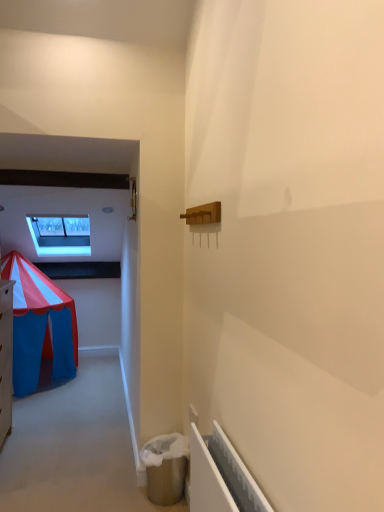
Question: Does white plastic radiator at lower right appear on the right side of transparent glass window at upper left?

Choices:
 (A) yes
 (B) no

Answer: (A)

Question: Does white plastic radiator at lower right have a larger size compared to transparent glass window at upper left?

Choices:
 (A) yes
 (B) no

Answer: (B)

Question: Is white plastic radiator at lower right turned away from transparent glass window at upper left?

Choices:
 (A) yes
 (B) no

Answer: (B)

Question: Would you say transparent glass window at upper left is part of white plastic radiator at lower right's contents?

Choices:
 (A) yes
 (B) no

Answer: (B)

Question: Is white plastic radiator at lower right taller than transparent glass window at upper left?

Choices:
 (A) yes
 (B) no

Answer: (B)

Question: Can we say white plastic radiator at lower right lies outside transparent glass window at upper left?

Choices:
 (A) no
 (B) yes

Answer: (B)

Question: From a real-world perspective, does transparent glass window at upper left stand above white plastic radiator at lower right?

Choices:
 (A) yes
 (B) no

Answer: (A)

Question: From the image's perspective, is transparent glass window at upper left located beneath white plastic radiator at lower right?

Choices:
 (A) yes
 (B) no

Answer: (B)

Question: Can you confirm if transparent glass window at upper left is taller than white plastic radiator at lower right?

Choices:
 (A) yes
 (B) no

Answer: (A)

Question: Does transparent glass window at upper left have a smaller size compared to white plastic radiator at lower right?

Choices:
 (A) yes
 (B) no

Answer: (B)

Question: Considering the relative sizes of transparent glass window at upper left and white plastic radiator at lower right in the image provided, is transparent glass window at upper left wider than white plastic radiator at lower right?

Choices:
 (A) no
 (B) yes

Answer: (B)

Question: Is the position of transparent glass window at upper left less distant than that of white plastic radiator at lower right?

Choices:
 (A) yes
 (B) no

Answer: (B)

Question: Visually, is transparent glass window at upper left positioned to the left or to the right of white plastic radiator at lower right?

Choices:
 (A) left
 (B) right

Answer: (A)